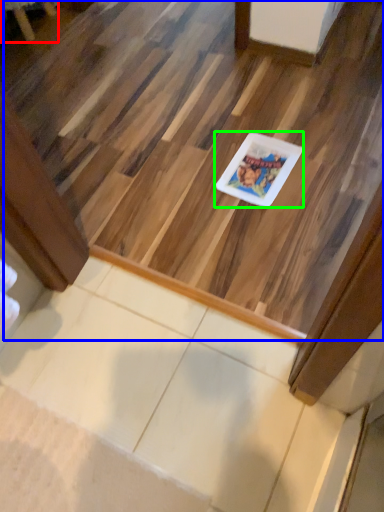
Question: Which object is the farthest from furniture (highlighted by a red box)? Choose among these: stairwell (highlighted by a blue box) or glass plate (highlighted by a green box).

Choices:
 (A) stairwell
 (B) glass plate

Answer: (B)